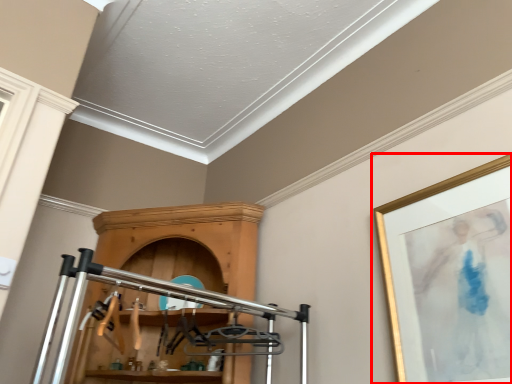
Question: From the image's perspective, what is the correct spatial relationship of picture frame (annotated by the red box) in relation to furniture?

Choices:
 (A) below
 (B) above

Answer: (B)